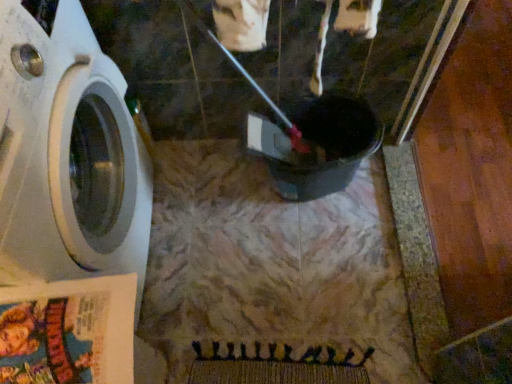
You are a GUI agent. You are given a task and a screenshot of the screen. Output one action in this format:
    pyautogui.click(x=<x>, y=<y>)
    Task: Click on the white matte washing machine at left
    
    Given the screenshot: What is the action you would take?
    pyautogui.click(x=67, y=153)

What do you see at coordinates (67, 153) in the screenshot? I see `white matte washing machine at left` at bounding box center [67, 153].

Where is `white matte washing machine at left`? The width and height of the screenshot is (512, 384). white matte washing machine at left is located at coordinates (67, 153).